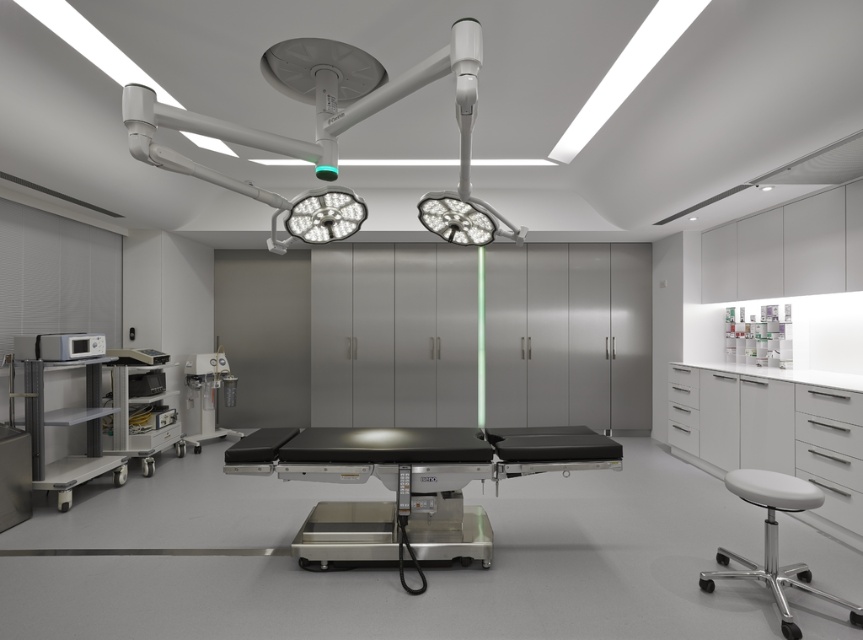
In the operating room scene, there is a black matte surgical table at center and a point marked at coordinates (408,483). Which object is located at the specified coordinates?

The point at coordinates (408,483) marks the black matte surgical table at center.

Consider the image. You are a medical technician in an operating room. You need to place a sterile instrument tray on the surface of the black matte surgical table at center, which is below the matte silver microwave at left. Will the tray fit on the table without any part hanging off the edge?

The black matte surgical table at center is located below the matte silver microwave at left, but the description does not provide information about the table dimensions or the tray size. Therefore, it is impossible to determine if the tray will fit without additional details.